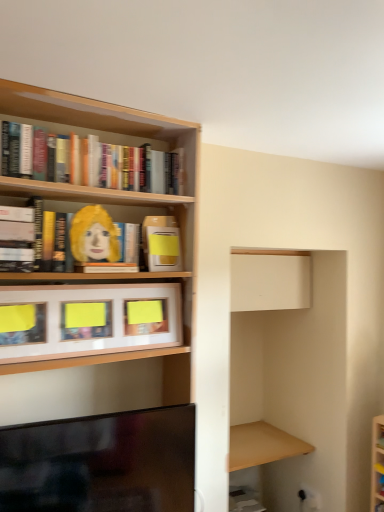
Question: Can you confirm if wooden at right is wider than black glossy tv at lower left?

Choices:
 (A) no
 (B) yes

Answer: (B)

Question: Considering the relative sizes of wooden at right and black glossy tv at lower left in the image provided, is wooden at right thinner than black glossy tv at lower left?

Choices:
 (A) yes
 (B) no

Answer: (B)

Question: Is wooden at right to the right of black glossy tv at lower left from the viewer's perspective?

Choices:
 (A) yes
 (B) no

Answer: (A)

Question: Is wooden at right oriented away from black glossy tv at lower left?

Choices:
 (A) no
 (B) yes

Answer: (A)

Question: From the image's perspective, is wooden at right on top of black glossy tv at lower left?

Choices:
 (A) yes
 (B) no

Answer: (B)

Question: Is wooden at right outside black glossy tv at lower left?

Choices:
 (A) no
 (B) yes

Answer: (B)

Question: Is matte yellow book at upper center, arranged as the first book when ordered from the bottom, located outside wooden at right?

Choices:
 (A) no
 (B) yes

Answer: (B)

Question: From the image's perspective, is matte yellow book at upper center, arranged as the first book when ordered from the bottom, on top of wooden at right?

Choices:
 (A) no
 (B) yes

Answer: (B)

Question: Is matte yellow book at upper center, acting as the 4th book starting from the top, oriented towards wooden at right?

Choices:
 (A) no
 (B) yes

Answer: (A)

Question: Does matte yellow book at upper center, acting as the 4th book starting from the top, appear on the right side of wooden at right?

Choices:
 (A) no
 (B) yes

Answer: (A)

Question: Can you confirm if matte yellow book at upper center, acting as the 4th book starting from the top, is positioned to the left of wooden at right?

Choices:
 (A) no
 (B) yes

Answer: (B)

Question: Does matte yellow book at upper center, arranged as the first book when ordered from the bottom, come behind wooden at right?

Choices:
 (A) no
 (B) yes

Answer: (A)

Question: Does wooden frame at center, which is the second cabinet from back to front, have a smaller size compared to matte yellow book at upper left, the 3th book ordered from the bottom?

Choices:
 (A) yes
 (B) no

Answer: (A)